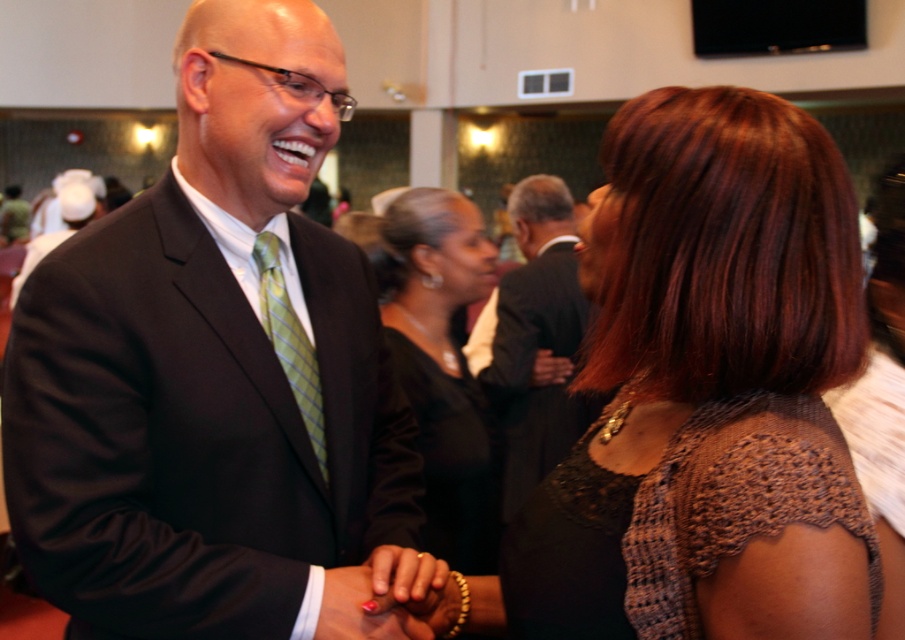
Image resolution: width=905 pixels, height=640 pixels. In order to click on brown lace dress at center in this screenshot , I will do `click(706, 392)`.

Which is below, brown lace dress at center or polished pink nail at center?

polished pink nail at center

Locate an element on the screen. The width and height of the screenshot is (905, 640). brown lace dress at center is located at coordinates (706, 392).

Can you confirm if black satin dress at center is wider than green plaid tie at center?

Indeed, black satin dress at center has a greater width compared to green plaid tie at center.

Can you confirm if black satin dress at center is taller than green plaid tie at center?

Yes.

You are a GUI agent. You are given a task and a screenshot of the screen. Output one action in this format:
    pyautogui.click(x=<x>, y=<y>)
    Task: Click on the black satin dress at center
    The width and height of the screenshot is (905, 640).
    Given the screenshot: What is the action you would take?
    pyautogui.click(x=441, y=364)

You are a GUI agent. You are given a task and a screenshot of the screen. Output one action in this format:
    pyautogui.click(x=<x>, y=<y>)
    Task: Click on the black satin dress at center
    
    Given the screenshot: What is the action you would take?
    pyautogui.click(x=441, y=364)

Is matte black suit at center taller than polished pink nail at center?

Correct, matte black suit at center is much taller as polished pink nail at center.

Who is positioned more to the right, matte black suit at center or polished pink nail at center?

Positioned to the right is polished pink nail at center.

Who is more forward, (x=176, y=372) or (x=322, y=625)?

Point (x=322, y=625) is more forward.

Where is `matte black suit at center`? Image resolution: width=905 pixels, height=640 pixels. matte black suit at center is located at coordinates [213, 369].